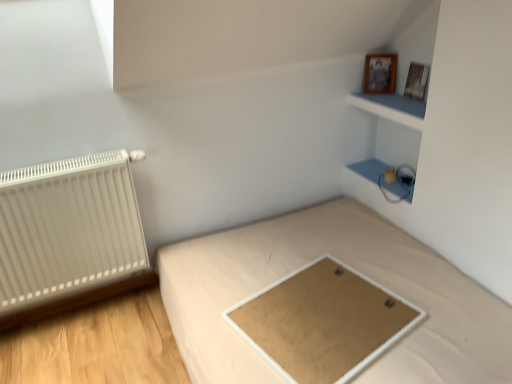
Find the location of a particular element. free spot above matte brown board at center (from a real-world perspective) is located at coordinates (316, 313).